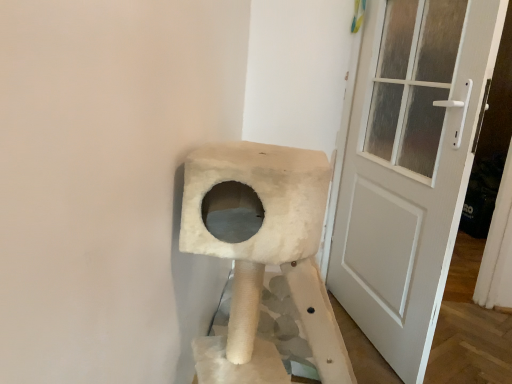
Question: Is white fluffy cat furniture at center inside or outside of white textured door at right?

Choices:
 (A) inside
 (B) outside

Answer: (B)

Question: In terms of size, does white fluffy cat furniture at center appear bigger or smaller than white textured door at right?

Choices:
 (A) big
 (B) small

Answer: (A)

Question: From a real-world perspective, is white fluffy cat furniture at center above or below white textured door at right?

Choices:
 (A) below
 (B) above

Answer: (A)

Question: Considering the positions of white textured door at right and white fluffy cat furniture at center in the image, is white textured door at right taller or shorter than white fluffy cat furniture at center?

Choices:
 (A) short
 (B) tall

Answer: (B)

Question: Is white textured door at right wider or thinner than white fluffy cat furniture at center?

Choices:
 (A) thin
 (B) wide

Answer: (A)

Question: From the image's perspective, is white textured door at right positioned above or below white fluffy cat furniture at center?

Choices:
 (A) below
 (B) above

Answer: (B)

Question: Is white textured door at right spatially inside white fluffy cat furniture at center, or outside of it?

Choices:
 (A) outside
 (B) inside

Answer: (A)